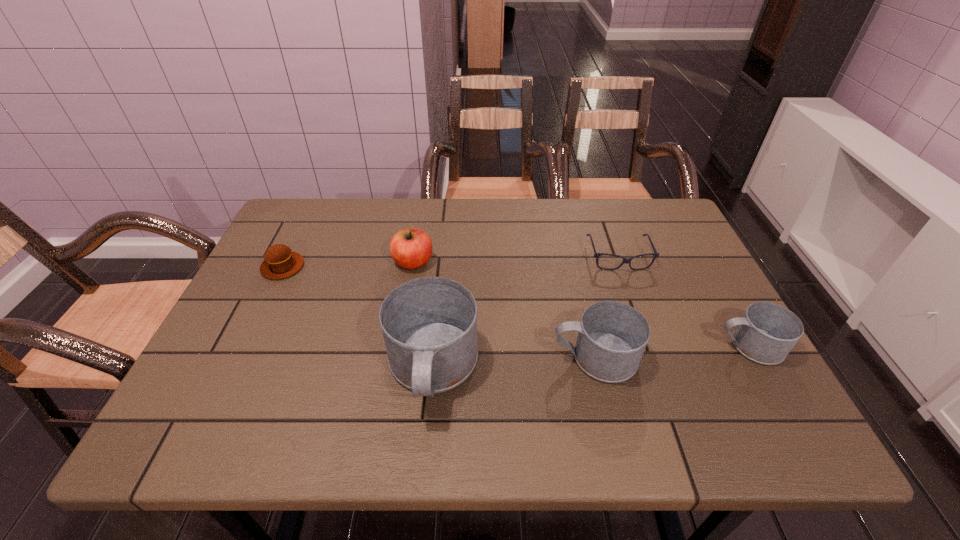
Locate an element on the screen. spectacles that is at the right edge is located at coordinates (596, 255).

Locate an element on the screen. This screenshot has height=540, width=960. object at the far right corner is located at coordinates (596, 255).

Locate an element on the screen. object at the near right corner is located at coordinates (767, 332).

Locate an element on the screen. Image resolution: width=960 pixels, height=540 pixels. blank space at the far edge of the desktop is located at coordinates (418, 200).

The width and height of the screenshot is (960, 540). In the image, there is a desktop. Find the location of `vacant space at the near edge`. vacant space at the near edge is located at coordinates (521, 367).

Identify the location of free space at the left edge. (255, 336).

The width and height of the screenshot is (960, 540). In order to click on free space at the far left corner of the desktop in this screenshot , I will do `click(294, 203)`.

The width and height of the screenshot is (960, 540). I want to click on free location at the far right corner of the desktop, so click(645, 243).

Find the location of a particular element. vacant area that lies between the apple and the muffin is located at coordinates (348, 265).

The image size is (960, 540). Find the location of `free space between the spectacles and the leftmost object`. free space between the spectacles and the leftmost object is located at coordinates (450, 262).